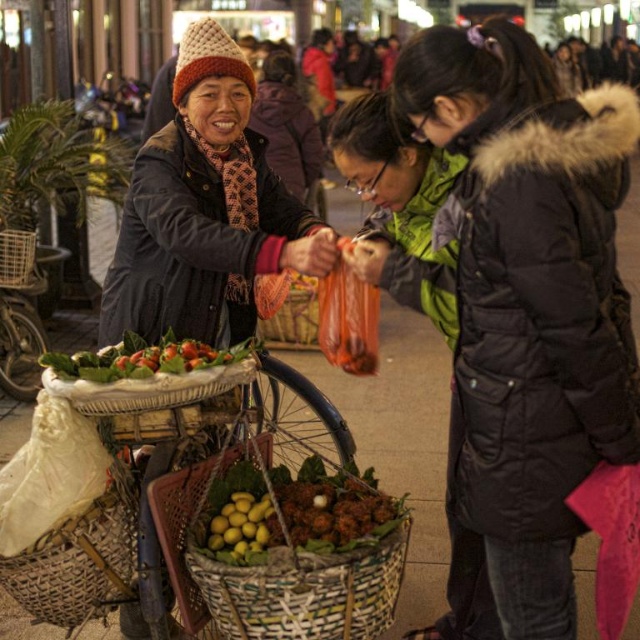
Question: Which of the following is the closest to the observer?

Choices:
 (A) yellow matte fruit at center
 (B) yellowish-green leafy vegetables at center
 (C) woven bamboo basket at left
 (D) woven brown basket at lower left

Answer: (B)

Question: Which is nearer to the knitted wool hat at upper left?

Choices:
 (A) black puffy coat at center
 (B) woven bamboo basket at left
 (C) brown woven basket at center
 (D) yellowish-green leafy vegetables at center

Answer: (D)

Question: Considering the relative positions of black puffy coat at center and knitted wool hat at upper left in the image provided, where is black puffy coat at center located with respect to knitted wool hat at upper left?

Choices:
 (A) right
 (B) left

Answer: (A)

Question: Does black puffy coat at center appear under green leafy vegetables at center?

Choices:
 (A) yes
 (B) no

Answer: (A)

Question: Which object is the closest to the knitted wool hat at upper left?

Choices:
 (A) yellowish-green leafy vegetables at center
 (B) woven bamboo basket at left
 (C) black puffy coat at center

Answer: (A)

Question: Is woven brown basket at lower left thinner than woven bamboo basket at left?

Choices:
 (A) yes
 (B) no

Answer: (B)